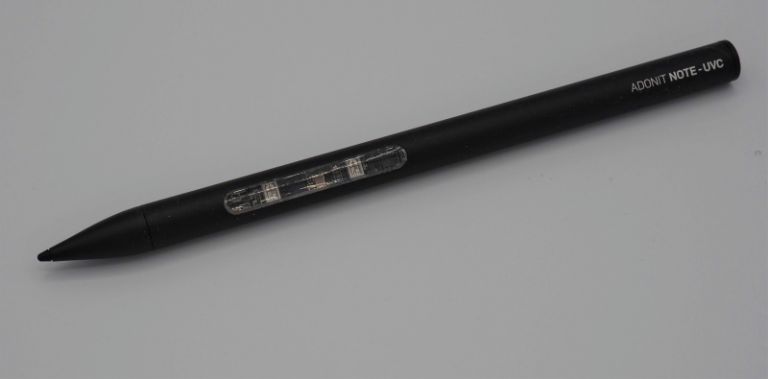
In order to click on mouse in this screenshot , I will do `click(356, 164)`.